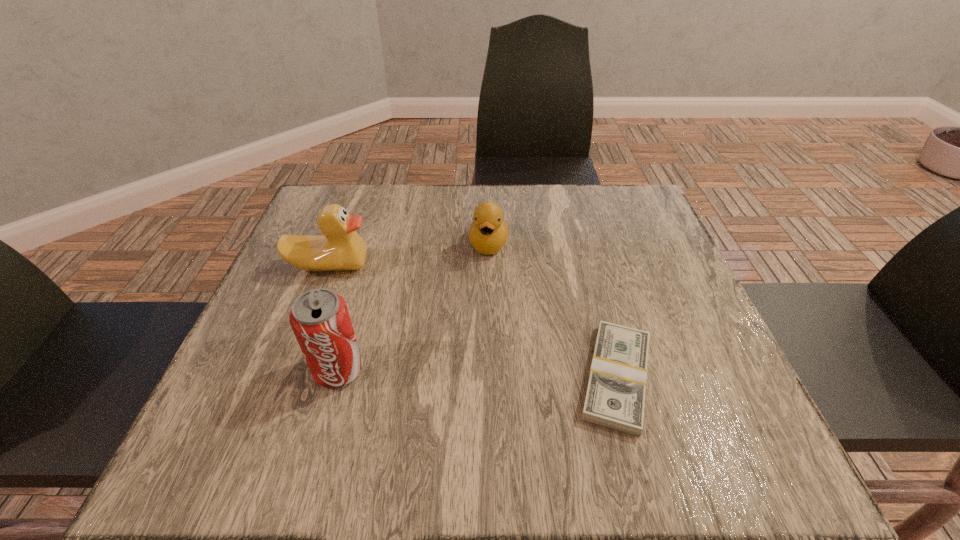
The height and width of the screenshot is (540, 960). In order to click on free space on the desktop that is between the soda can and the rightmost object and is positioned on the face of the third tallest object in this screenshot , I will do `click(475, 373)`.

The width and height of the screenshot is (960, 540). Identify the location of free space on the desktop that is between the soda can and the rightmost object and is positioned at the beak of the duck. (466, 373).